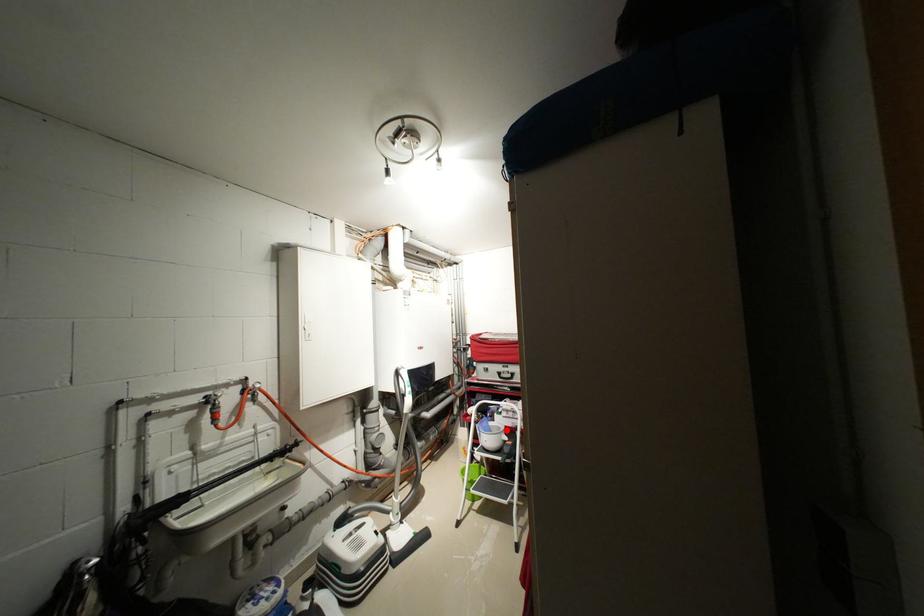
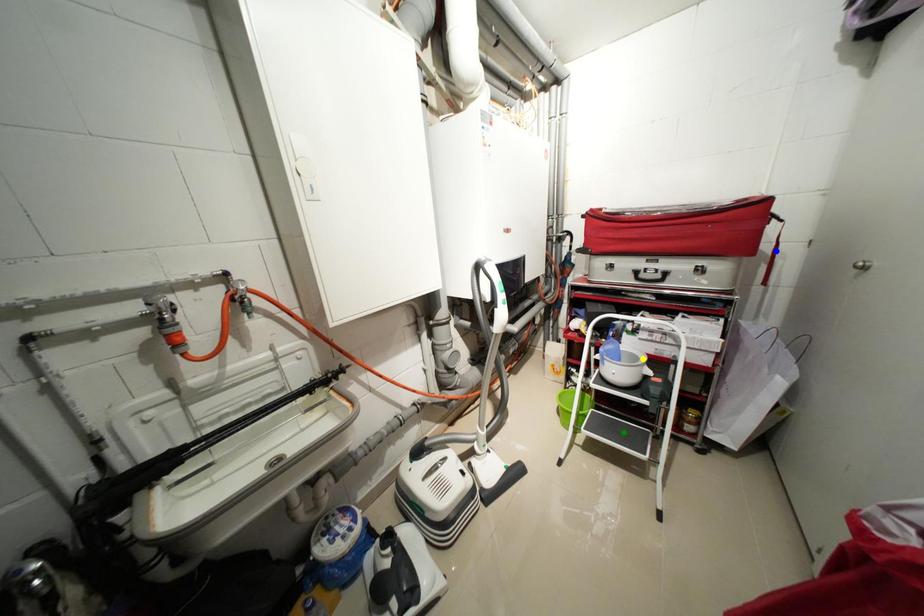
Question: I am providing you with two images of the same scene from different viewpoints. A red point is marked on the first image. You are given multiple points on the second image. Can you choose the point in image 2 that corresponds to the point in image 1?

Choices:
 (A) blue point
 (B) yellow point
 (C) green point

Answer: (B)